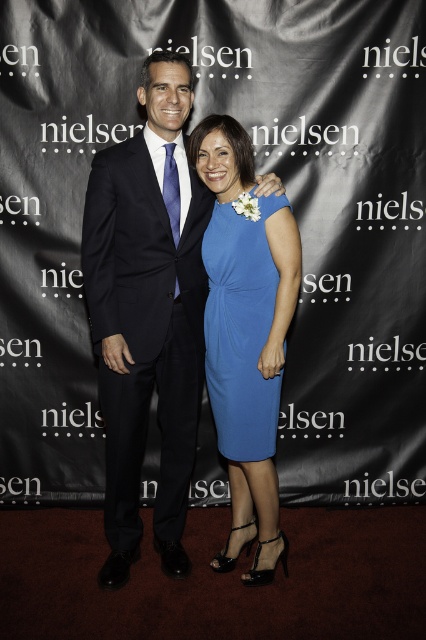
Question: Which object is closer to the camera taking this photo?

Choices:
 (A) matte black suit at center
 (B) blue satin dress at center
 (C) matte blue dress at center

Answer: (A)

Question: Which of the following is the closest to the observer?

Choices:
 (A) (244, 236)
 (B) (161, 496)
 (C) (270, 442)

Answer: (A)

Question: Does matte black suit at center appear on the left side of blue satin dress at center?

Choices:
 (A) yes
 (B) no

Answer: (A)

Question: Among these points, which one is farthest from the camera?

Choices:
 (A) (293, 227)
 (B) (132, 340)
 (C) (284, 198)

Answer: (B)

Question: Can you confirm if matte black suit at center is smaller than blue satin dress at center?

Choices:
 (A) no
 (B) yes

Answer: (A)

Question: Does matte black suit at center have a larger size compared to blue satin dress at center?

Choices:
 (A) yes
 (B) no

Answer: (A)